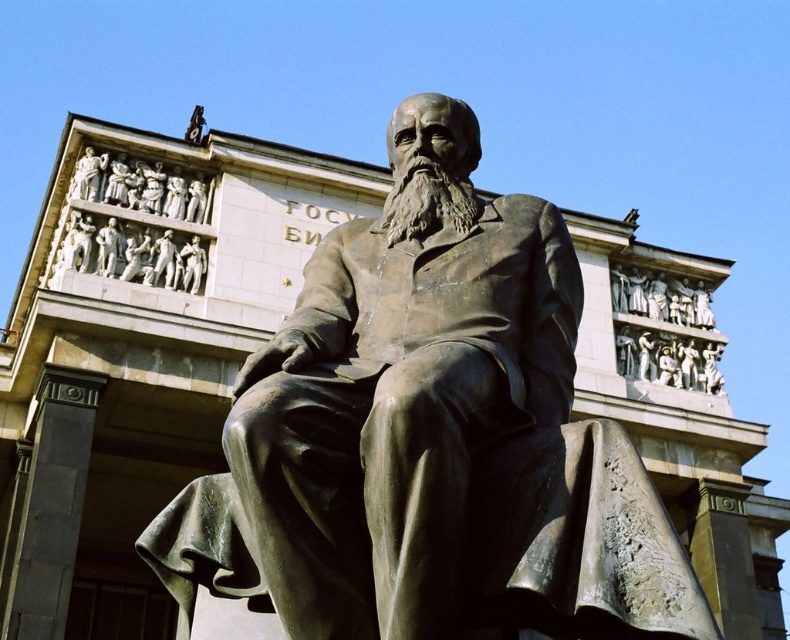
Question: Can you confirm if bronze statue at center is positioned above brown metallic beard at center?

Choices:
 (A) no
 (B) yes

Answer: (A)

Question: Is the position of bronze statue at center more distant than that of brown metallic beard at center?

Choices:
 (A) no
 (B) yes

Answer: (A)

Question: Where is bronze statue at center located in relation to brown metallic beard at center in the image?

Choices:
 (A) below
 (B) above

Answer: (A)

Question: Which point is farther to the camera?

Choices:
 (A) (461, 342)
 (B) (463, 193)

Answer: (B)